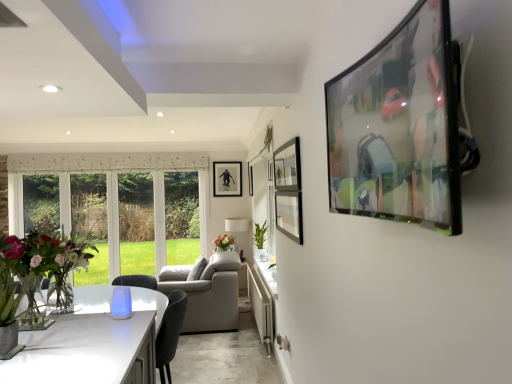
Question: Considering the positions of point (29, 233) and point (432, 26), is point (29, 233) closer or farther from the camera than point (432, 26)?

Choices:
 (A) farther
 (B) closer

Answer: (A)

Question: From their relative heights in the image, would you say matte glass vase at left is taller or shorter than matte black tv at upper right, marked as the third picture frame in a back-to-front arrangement?

Choices:
 (A) short
 (B) tall

Answer: (B)

Question: Considering the real-world distances, which object is farthest from the white glossy counter top at lower center?

Choices:
 (A) matte black picture frame at center, arranged as the second picture frame when viewed from the right
 (B) metallic silver picture frame at center, acting as the third picture frame starting from the right
 (C) matte glass vase at left
 (D) green glossy plant at center
 (E) translucent glass vase at center

Answer: (C)

Question: Which object is positioned farthest from the white glossy counter top at lower center?

Choices:
 (A) translucent glass vase at center
 (B) green glossy plant at center
 (C) metallic silver picture frame at center, placed as the 3th picture frame when sorted from front to back
 (D) matte black tv at upper right, marked as the third picture frame in a back-to-front arrangement
 (E) matte black picture frame at center, arranged as the second picture frame when viewed from the right

Answer: (D)